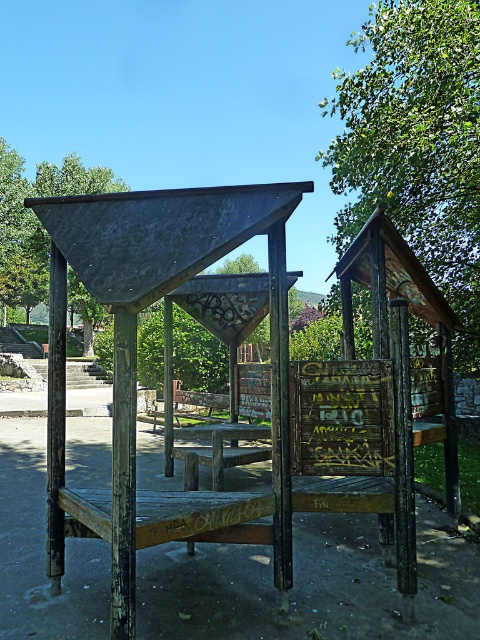
Question: Which object is the farthest from the green leafy tree at upper left?

Choices:
 (A) dark green wood at upper left
 (B) green leafy tree at upper right
 (C) rusty wood gazebo at center

Answer: (C)

Question: Is rusty wood gazebo at center positioned before dark green wood at upper left?

Choices:
 (A) no
 (B) yes

Answer: (B)

Question: Does green leafy tree at upper right appear on the left side of green leafy tree at upper left?

Choices:
 (A) no
 (B) yes

Answer: (A)

Question: Among these points, which one is nearest to the camera?

Choices:
 (A) (100, 176)
 (B) (10, 208)

Answer: (B)

Question: Does green leafy tree at upper left have a lesser width compared to wooden picnic table at center?

Choices:
 (A) yes
 (B) no

Answer: (B)

Question: Estimate the real-world distances between objects in this image. Which object is closer to the dark green wood at upper left?

Choices:
 (A) green leafy tree at upper right
 (B) green leafy tree at upper left
 (C) wooden picnic table at center

Answer: (B)